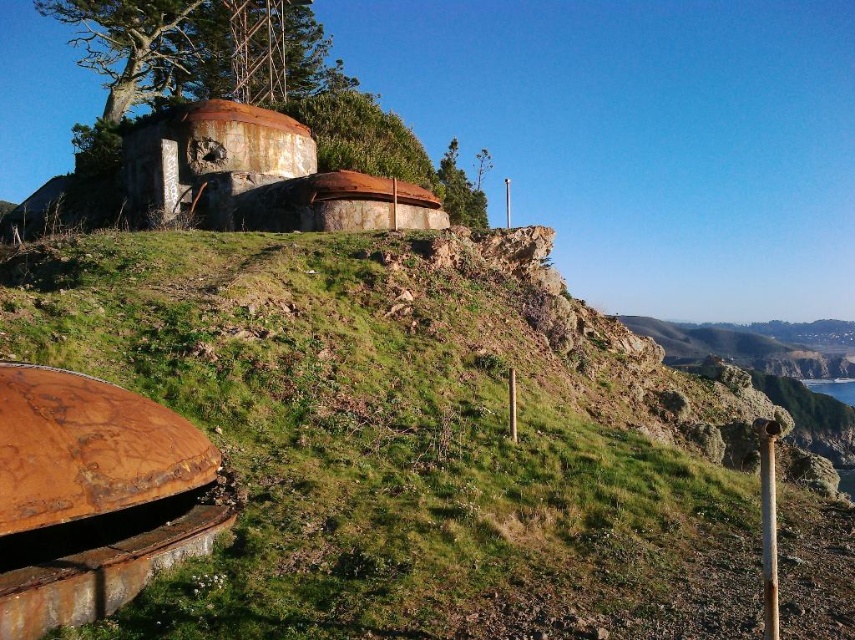
Is green grassy at center above green leafy tree at upper center?

Incorrect, green grassy at center is not positioned above green leafy tree at upper center.

Between green grassy at center and green leafy tree at upper center, which one appears on the right side from the viewer's perspective?

Positioned to the right is green leafy tree at upper center.

Is point (663, 632) positioned in front of point (441, 204)?

Yes.

Where is `green grassy at center`? green grassy at center is located at coordinates (407, 442).

Looking at this image, who is positioned more to the right, green grassy at center or green leafy tree at upper left?

green grassy at center

Is point (37, 275) behind point (296, 67)?

No, (37, 275) is closer to viewer.

Is point (594, 353) positioned behind point (51, 8)?

No, (594, 353) is closer to viewer.

The height and width of the screenshot is (640, 855). Identify the location of green grassy at center. (407, 442).

In the scene shown: Is green leafy tree at upper left closer to camera compared to green leafy tree at upper center?

No.

Is green leafy tree at upper left thinner than green leafy tree at upper center?

Incorrect, green leafy tree at upper left's width is not less than green leafy tree at upper center's.

Where is `green leafy tree at upper left`? Image resolution: width=855 pixels, height=640 pixels. green leafy tree at upper left is located at coordinates (198, 51).

Locate an element on the screen. The image size is (855, 640). green leafy tree at upper left is located at coordinates (198, 51).